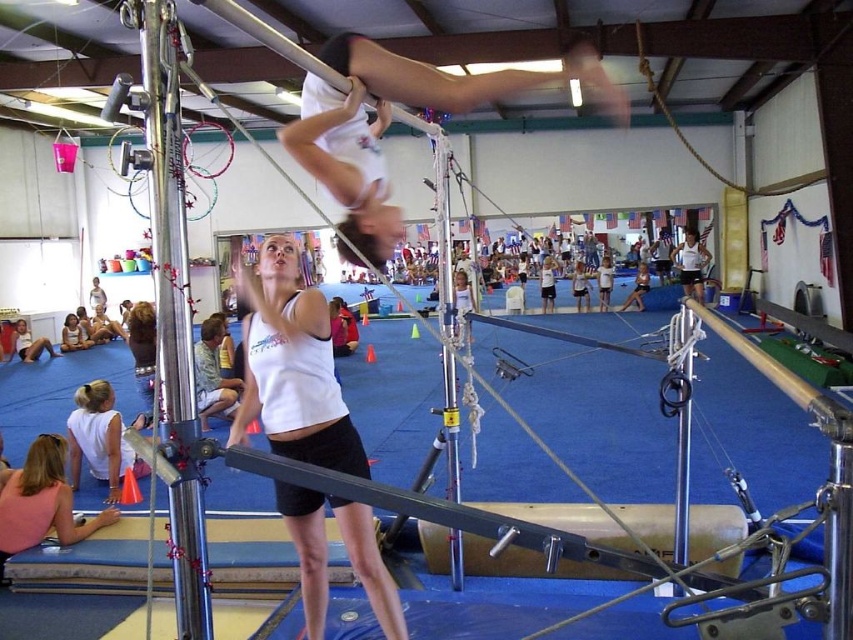
You are a photographer in the gym. You want to take a photo of the white matte tank top at center and the white glossy pole at upper center. Based on their positions, which object should you focus on first to ensure both are in the frame?

The white matte tank top at center is below the white glossy pole at upper center, so you should focus on the white glossy pole at upper center first to ensure both are in the frame.

You are standing in the gym and want to place a 5 feet long pole from your current position to the point at coordinates point (486, 532). Can you fit the pole without bending it?

A: The distance between you and point (486, 532) is 4.93 feet, so the pole will fit since it is shorter than the pole length.

You are a photographer standing at the entrance of the gym. You want to take a photo of two points marked in the image. Which point, point (x=270, y=465) or point (x=36, y=502), will appear larger in your photo?

Point (x=270, y=465) will appear larger in the photo because it is closer to the camera than point (x=36, y=502).